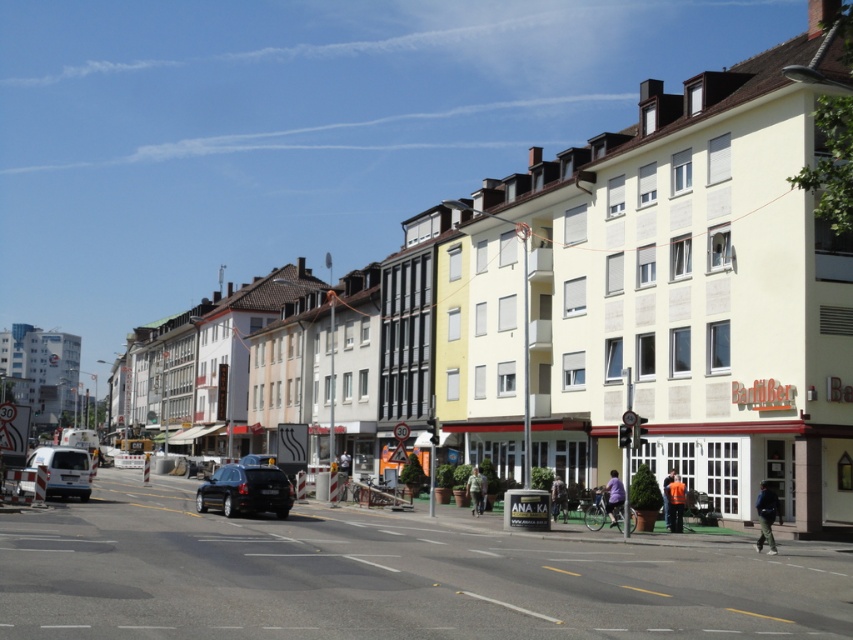
Question: Can you confirm if shiny black car at center is smaller than white matte van at lower left?

Choices:
 (A) no
 (B) yes

Answer: (B)

Question: Observing the image, what is the correct spatial positioning of shiny black car at center in reference to white matte van at lower left?

Choices:
 (A) left
 (B) right

Answer: (B)

Question: Which object is closer to the camera taking this photo?

Choices:
 (A) shiny black car at center
 (B) white matte van at lower left

Answer: (A)

Question: Does shiny black car at center appear on the left side of white matte van at lower left?

Choices:
 (A) no
 (B) yes

Answer: (A)

Question: Among these objects, which one is farthest from the camera?

Choices:
 (A) white matte van at lower left
 (B) shiny black car at center

Answer: (A)